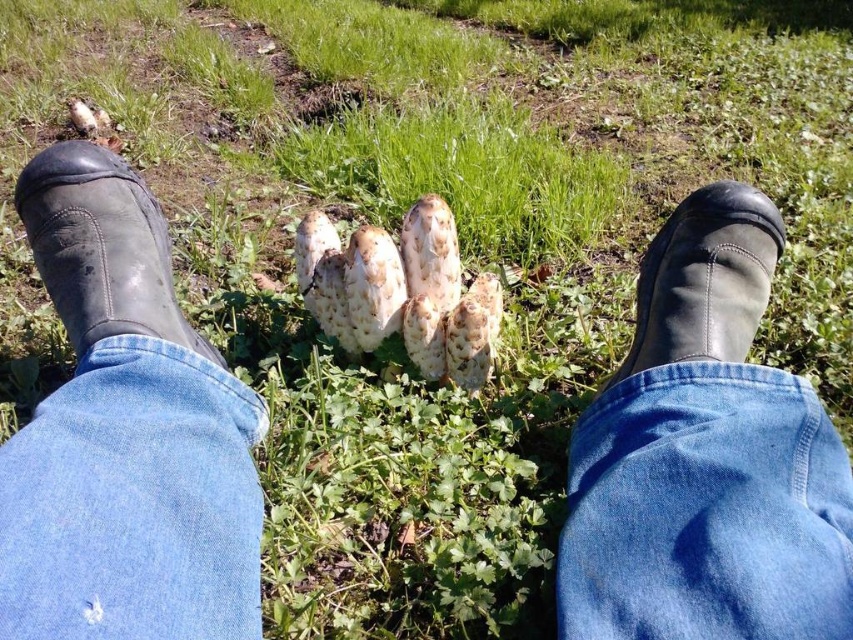
Question: Which of the following is the farthest from the observer?

Choices:
 (A) (653, 237)
 (B) (704, 456)
 (C) (112, 198)

Answer: (A)

Question: Among these objects, which one is nearest to the camera?

Choices:
 (A) denim at center
 (B) black leather boot at left
 (C) black leather boot at center
 (D) denim at lower left

Answer: (D)

Question: Is denim at center above denim at lower left?

Choices:
 (A) yes
 (B) no

Answer: (B)

Question: Considering the relative positions of denim at center and black leather boot at center in the image provided, where is denim at center located with respect to black leather boot at center?

Choices:
 (A) below
 (B) above

Answer: (A)

Question: Which object is closer to the camera taking this photo?

Choices:
 (A) denim at lower left
 (B) black leather boot at left
 (C) black leather boot at center

Answer: (A)

Question: Does denim at center come behind black leather boot at left?

Choices:
 (A) no
 (B) yes

Answer: (A)